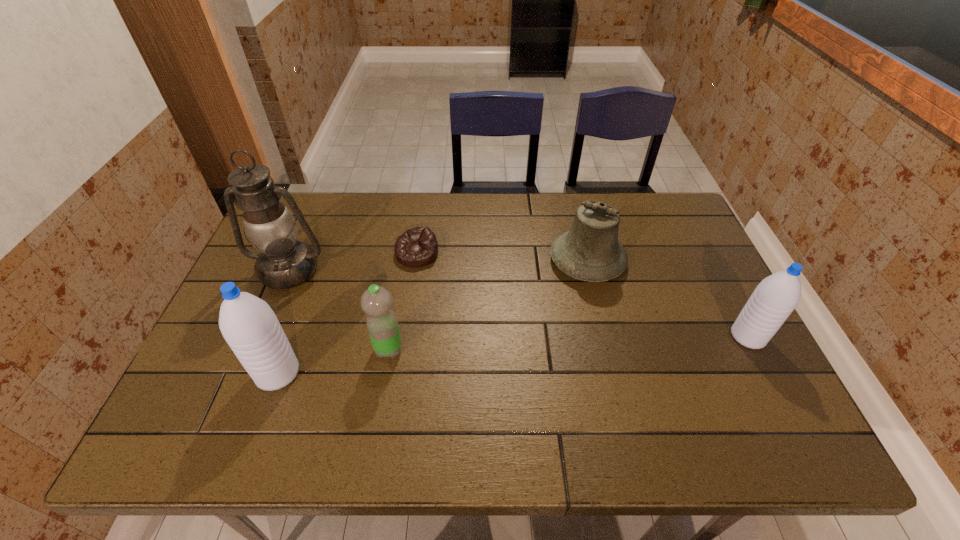
The image size is (960, 540). I want to click on free spot between the rightmost object and the tallest object, so click(518, 303).

Find the location of a particular element. empty location between the second water bottle from right to left and the tallest object is located at coordinates (339, 309).

Find the location of a particular element. vacant region between the beanbag and the fifth object from left to right is located at coordinates (502, 258).

Where is `vacant point located between the rightmost water bottle and the beanbag`? Image resolution: width=960 pixels, height=540 pixels. vacant point located between the rightmost water bottle and the beanbag is located at coordinates (583, 295).

Where is `the second closest object to the bell`? This screenshot has width=960, height=540. the second closest object to the bell is located at coordinates (416, 247).

Identify which object is located as the second nearest to the second water bottle from left to right. Please provide its 2D coordinates. Your answer should be formatted as a tuple, i.e. [(x, y)], where the tuple contains the x and y coordinates of a point satisfying the conditions above.

[(284, 262)]

You are a GUI agent. You are given a task and a screenshot of the screen. Output one action in this format:
    pyautogui.click(x=<x>, y=<y>)
    Task: Click on the water bottle that stands as the closest to the tallest object
    The image size is (960, 540).
    Given the screenshot: What is the action you would take?
    pyautogui.click(x=248, y=324)

I want to click on water bottle object that ranks as the third closest to the second object from right to left, so click(248, 324).

This screenshot has height=540, width=960. Identify the location of vacant area that satisfies the following two spatial constraints: 1. on the back side of the rightmost water bottle; 2. on the left side of the leftmost water bottle. 291,337.